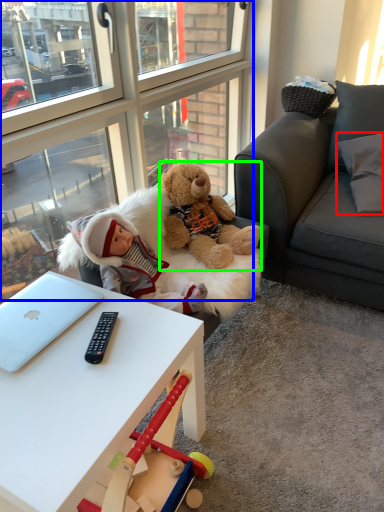
Question: Considering the real-world distances, which object is farthest from pillow (highlighted by a red box)? glass door (highlighted by a blue box) or teddy bear (highlighted by a green box)?

Choices:
 (A) glass door
 (B) teddy bear

Answer: (A)